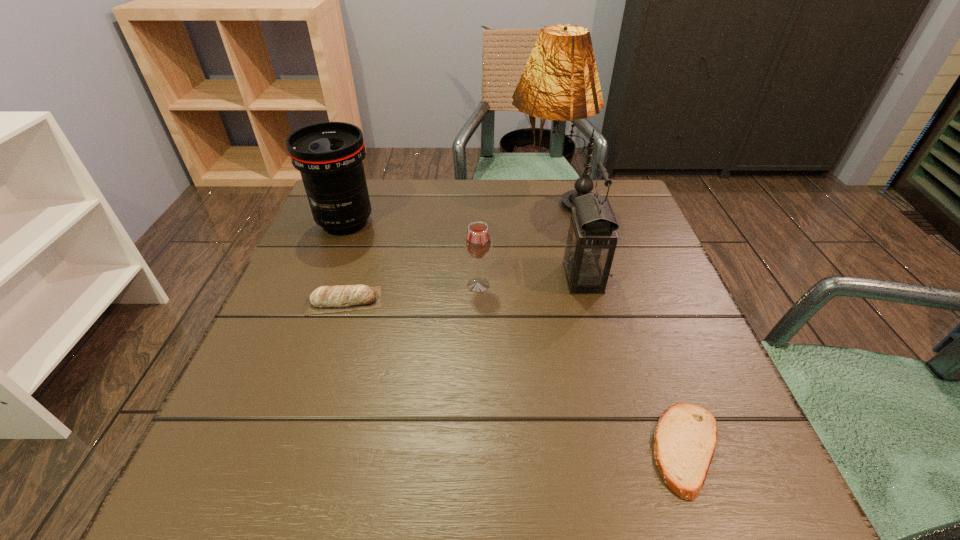
At what (x,y) coordinates should I click in order to perform the action: click on free spot at the far edge of the desktop. Please return your answer as a coordinate pair (x, y). Looking at the image, I should click on (423, 202).

Image resolution: width=960 pixels, height=540 pixels. In the image, there is a desktop. Identify the location of vacant space at the near edge. (358, 492).

I want to click on free space at the left edge of the desktop, so click(339, 252).

In the image, there is a desktop. Where is `vacant space at the right edge`? The image size is (960, 540). vacant space at the right edge is located at coordinates (645, 384).

Where is `vacant region at the far left corner of the desktop`? This screenshot has height=540, width=960. vacant region at the far left corner of the desktop is located at coordinates (366, 227).

This screenshot has width=960, height=540. What are the coordinates of `free space at the near left corner` in the screenshot? It's located at (290, 482).

I want to click on free space between the fifth tallest object and the wineglass, so click(411, 293).

I want to click on free point between the tallest object and the taller pita bread, so click(448, 251).

Locate an element on the screen. The image size is (960, 540). empty location between the nearer pita bread and the tallest object is located at coordinates (620, 324).

The height and width of the screenshot is (540, 960). Identify the location of empty location between the telephoto lens and the third object from left to right. (412, 254).